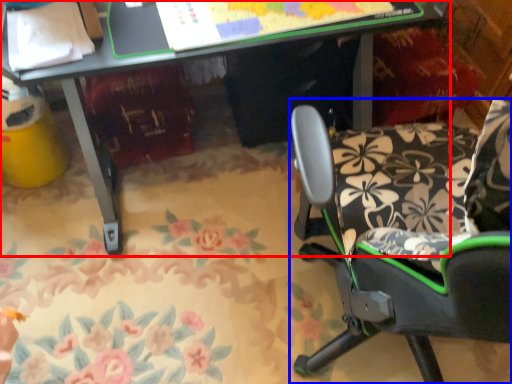
Question: Which point is closer to the camera, desk (highlighted by a red box) or chair (highlighted by a blue box)?

Choices:
 (A) desk
 (B) chair

Answer: (B)